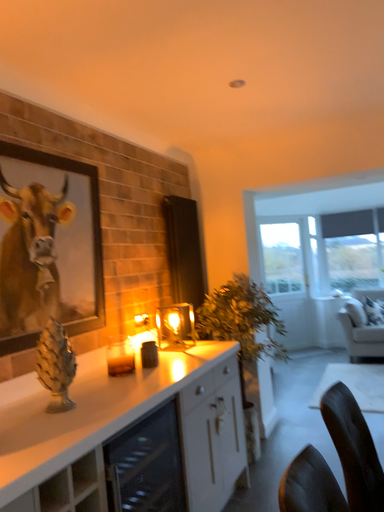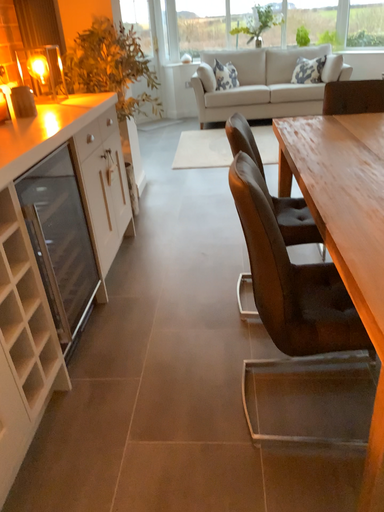
Question: Which way did the camera rotate in the video?

Choices:
 (A) rotated left
 (B) rotated right

Answer: (B)